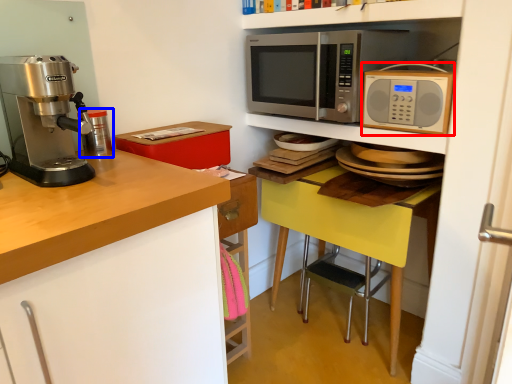
Question: Among these objects, which one is farthest to the camera, microwave oven (highlighted by a red box) or appliance (highlighted by a blue box)?

Choices:
 (A) microwave oven
 (B) appliance

Answer: (A)